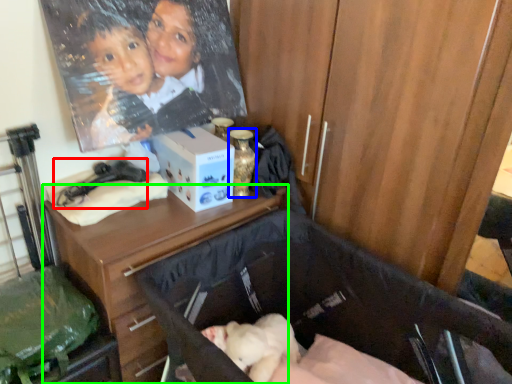
Question: Based on their relative distances, which object is farther from twin (highlighted by a red box)? Choose from bottle (highlighted by a blue box) and desk (highlighted by a green box).

Choices:
 (A) bottle
 (B) desk

Answer: (A)